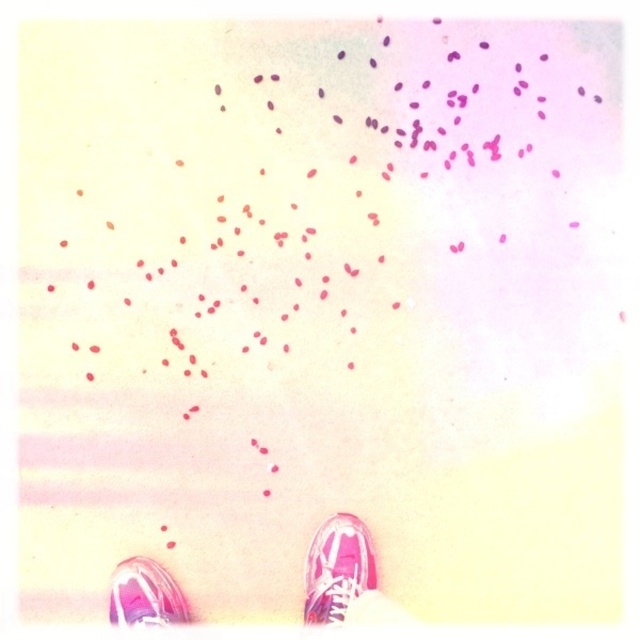
Question: Can you confirm if pink canvas shoes at lower center is wider than pink glossy shoe at lower left?

Choices:
 (A) yes
 (B) no

Answer: (A)

Question: Which of these objects is positioned closest to the pink canvas shoe at lower right?

Choices:
 (A) pink canvas shoes at lower center
 (B) pink glossy shoe at lower left

Answer: (A)

Question: Which of these objects is positioned farthest from the pink canvas shoes at lower center?

Choices:
 (A) pink canvas shoe at lower right
 (B) pink glossy shoe at lower left

Answer: (B)

Question: Which is farther from the pink canvas shoe at lower right?

Choices:
 (A) pink canvas shoes at lower center
 (B) pink glossy shoe at lower left

Answer: (B)

Question: Does pink canvas shoe at lower right appear over pink glossy shoe at lower left?

Choices:
 (A) yes
 (B) no

Answer: (A)

Question: Observing the image, what is the correct spatial positioning of pink canvas shoes at lower center in reference to pink glossy shoe at lower left?

Choices:
 (A) left
 (B) right

Answer: (B)